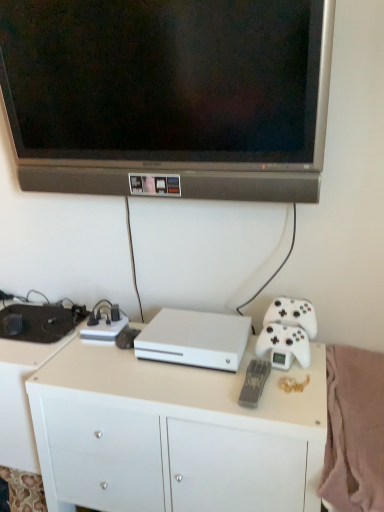
Find the location of a particular element. free space to the left of white matte console at center is located at coordinates (104, 366).